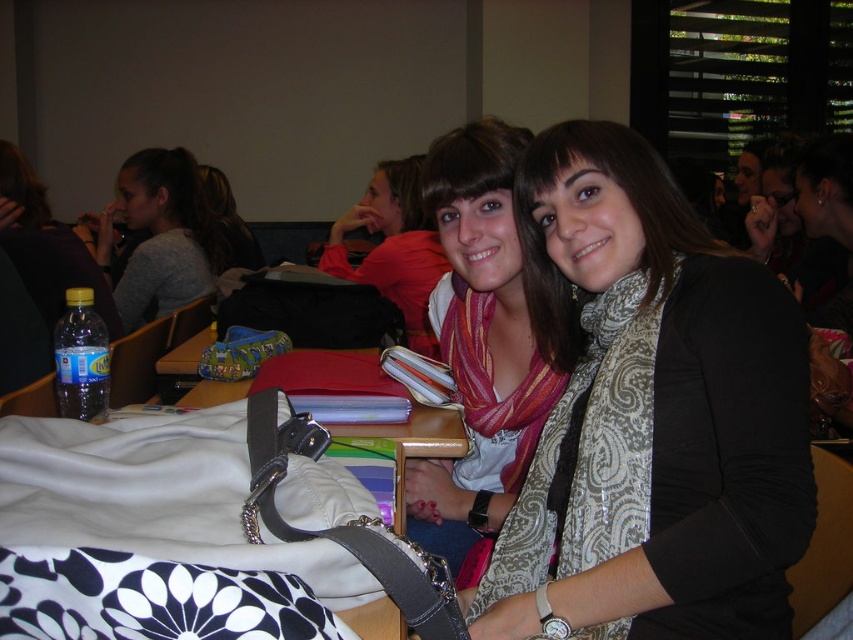
Question: Among these points, which one is nearest to the camera?

Choices:
 (A) (518, 176)
 (B) (489, 476)

Answer: (A)

Question: Is gray sweater at left to the left of matte red sweater at center from the viewer's perspective?

Choices:
 (A) yes
 (B) no

Answer: (A)

Question: Which point is closer to the camera?

Choices:
 (A) (386, 243)
 (B) (166, 198)
 (C) (776, 348)

Answer: (C)

Question: Does patterned scarf at center have a lesser width compared to matte pink scarf at center?

Choices:
 (A) no
 (B) yes

Answer: (A)

Question: Which point is farther from the camera taking this photo?

Choices:
 (A) (706, 611)
 (B) (509, 220)

Answer: (B)

Question: Can you confirm if matte pink scarf at center is smaller than matte red sweater at center?

Choices:
 (A) no
 (B) yes

Answer: (B)